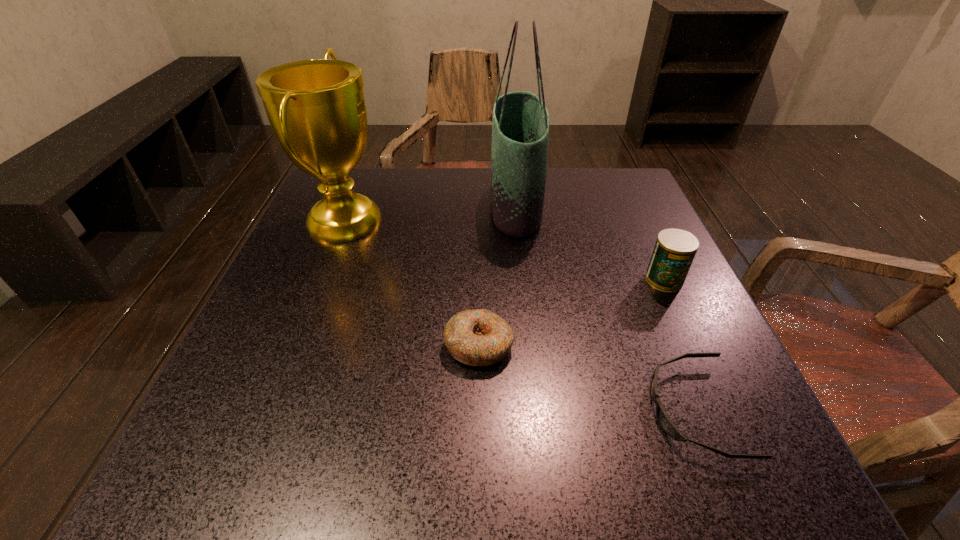
At what (x,y) coordinates should I click in order to perform the action: click on vacant space located 0.370m on the front-facing side of the sunglasses. Please return your answer as a coordinate pair (x, y). The height and width of the screenshot is (540, 960). Looking at the image, I should click on (396, 410).

Where is `free space located 0.070m on the front-facing side of the sunglasses`? This screenshot has width=960, height=540. free space located 0.070m on the front-facing side of the sunglasses is located at coordinates (604, 410).

Find the location of a particular element. The height and width of the screenshot is (540, 960). vacant area situated on the front-facing side of the sunglasses is located at coordinates (583, 410).

Find the location of a particular element. The height and width of the screenshot is (540, 960). tote bag at the far edge is located at coordinates (520, 123).

Find the location of a particular element. Image resolution: width=960 pixels, height=540 pixels. award located at the far edge is located at coordinates (316, 108).

The image size is (960, 540). I want to click on object that is at the near edge, so click(x=665, y=422).

You are a GUI agent. You are given a task and a screenshot of the screen. Output one action in this format:
    pyautogui.click(x=<x>, y=<y>)
    Task: Click on the object located in the left edge section of the desktop
    This screenshot has width=960, height=540.
    Given the screenshot: What is the action you would take?
    pyautogui.click(x=316, y=108)

Find the location of `can positioned at the right edge`. can positioned at the right edge is located at coordinates (675, 249).

At what (x,y) coordinates should I click in order to perform the action: click on sunglasses that is at the right edge. Please return your answer as a coordinate pair (x, y). The width and height of the screenshot is (960, 540). Looking at the image, I should click on (665, 422).

Identify the location of object that is at the far left corner. (316, 108).